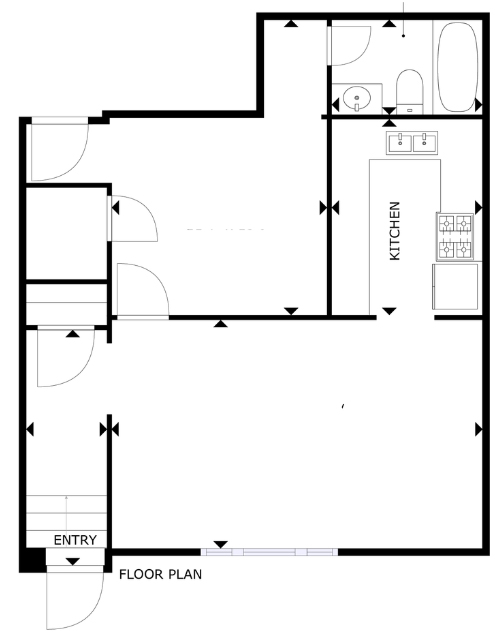
Where is `floor plan`? The height and width of the screenshot is (642, 500). floor plan is located at coordinates (145, 576).